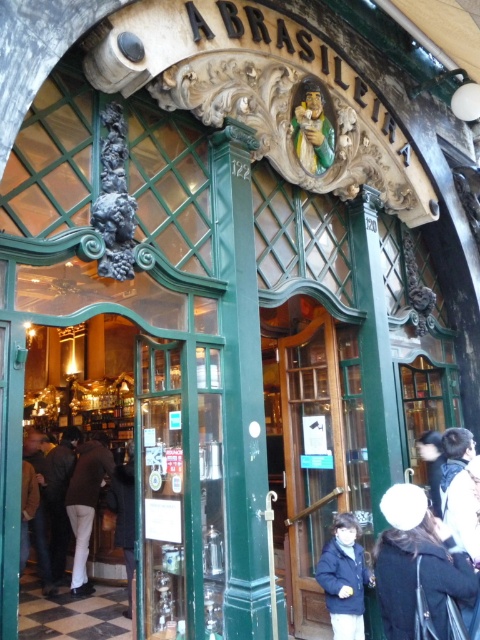
You are a visitor standing at the entrance of A Brasileira. You notice the green polished wood pillar at center and the white matte pants at lower left. Which object is taller?

The green polished wood pillar at center is much taller than the white matte pants at lower left.

Consider the image. You are standing at the entrance of A Brasileira and want to place a small plant between the two points marked as point (x=242, y=529) and point (x=74, y=563). Which point should the plant be closer to in order to be nearer to the viewer?

The plant should be placed closer to point (x=242, y=529) because it is closer to the viewer than point (x=74, y=563).